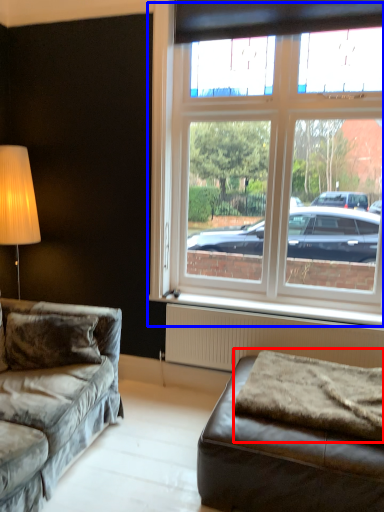
Question: Which object is further to the camera taking this photo, blanket (highlighted by a red box) or window (highlighted by a blue box)?

Choices:
 (A) blanket
 (B) window

Answer: (B)